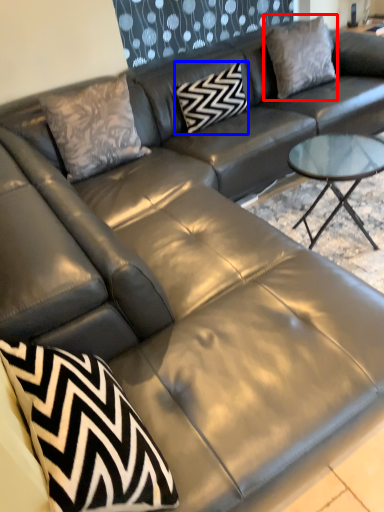
Question: Which point is further to the camera, pillow (highlighted by a red box) or pillow (highlighted by a blue box)?

Choices:
 (A) pillow
 (B) pillow

Answer: (A)